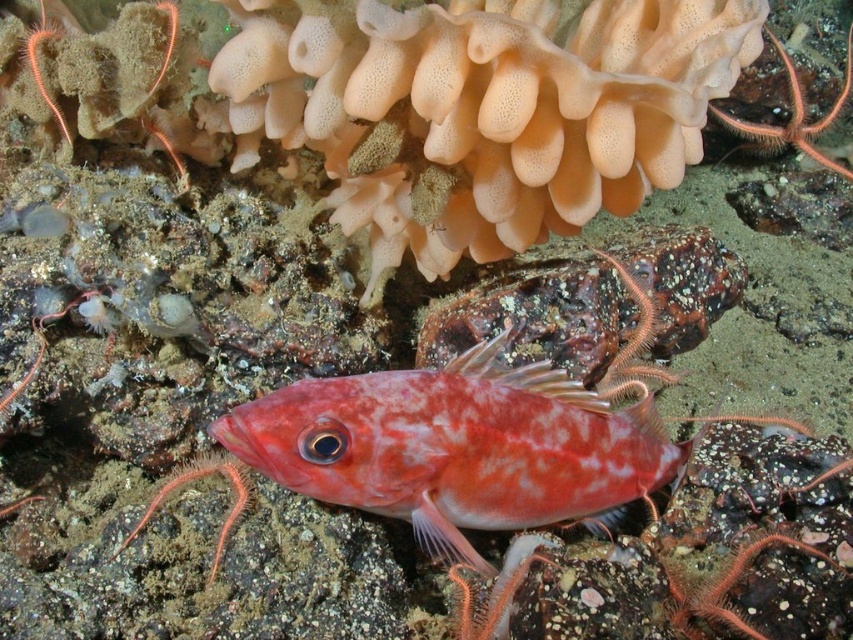
Is shiny pink fish at center further to camera compared to speckled rock at center?

No, it is not.

Who is higher up, shiny pink fish at center or speckled rock at center?

speckled rock at center is above.

Between point (552, 497) and point (556, 330), which one is positioned in front?

Point (552, 497) is more forward.

The height and width of the screenshot is (640, 853). I want to click on shiny pink fish at center, so [x=456, y=448].